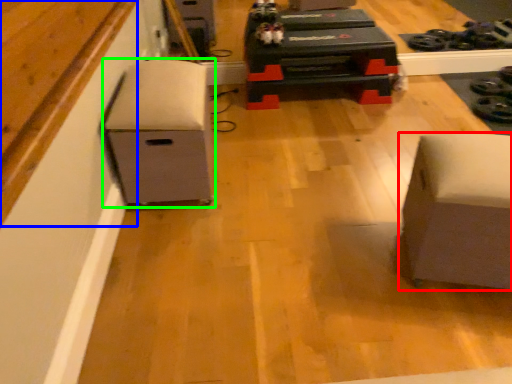
Question: Estimate the real-world distances between objects in this image. Which object is farther from furniture (highlighted by a red box), wood (highlighted by a blue box) or furniture (highlighted by a green box)?

Choices:
 (A) wood
 (B) furniture

Answer: (A)